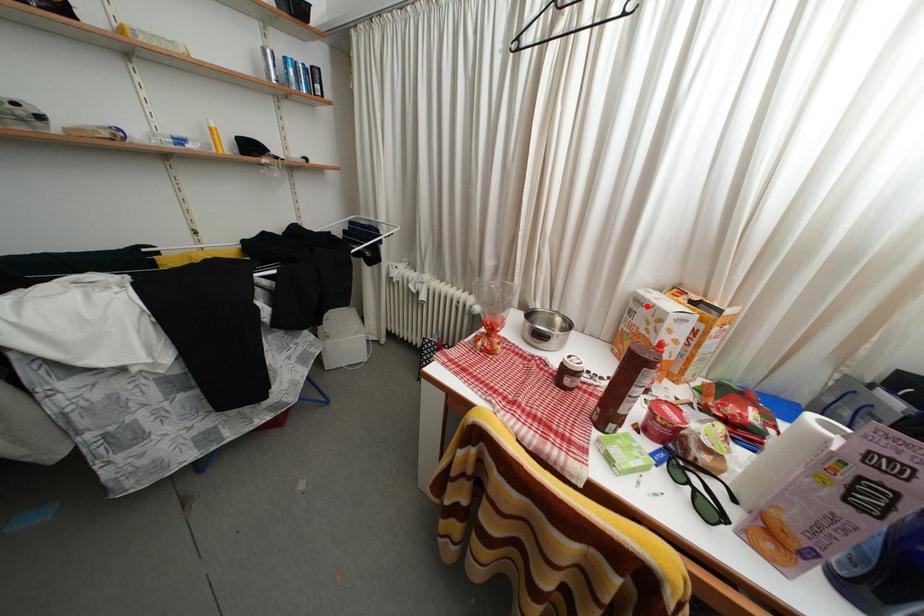
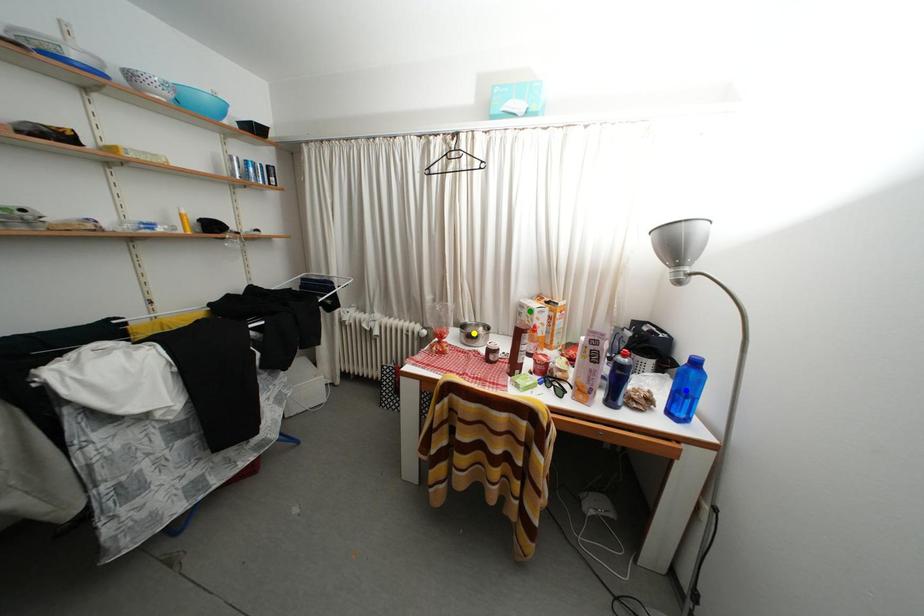
Question: I am providing you with two images of the same scene from different viewpoints. A red point is marked on the first image. You are given multiple points on the second image. In image 2, which mark is for the same physical point as the one in image 1?

Choices:
 (A) yellow point
 (B) blue point
 (C) green point

Answer: (C)